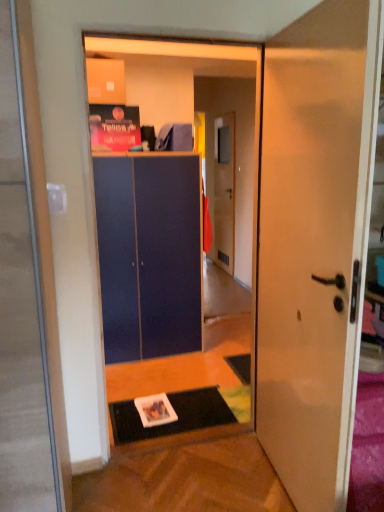
Question: From the image's perspective, is matte blue cabinet at center on top of wooden door at center, which is counted as the 2th door, starting from the front?

Choices:
 (A) no
 (B) yes

Answer: (A)

Question: From a real-world perspective, does matte blue cabinet at center stand above wooden door at center, which appears as the 1th door when viewed from the back?

Choices:
 (A) no
 (B) yes

Answer: (A)

Question: Can you confirm if matte blue cabinet at center is thinner than wooden door at center, which appears as the 1th door when viewed from the back?

Choices:
 (A) yes
 (B) no

Answer: (B)

Question: Considering the relative sizes of matte blue cabinet at center and wooden door at center, which is counted as the 2th door, starting from the front, in the image provided, is matte blue cabinet at center shorter than wooden door at center, which is counted as the 2th door, starting from the front,?

Choices:
 (A) no
 (B) yes

Answer: (B)

Question: Does matte blue cabinet at center lie behind wooden door at center, which is counted as the 2th door, starting from the front?

Choices:
 (A) yes
 (B) no

Answer: (B)

Question: Considering the relative sizes of matte blue cabinet at center and wooden door at center, which appears as the 1th door when viewed from the back, in the image provided, is matte blue cabinet at center bigger than wooden door at center, which appears as the 1th door when viewed from the back,?

Choices:
 (A) no
 (B) yes

Answer: (B)

Question: Considering the relative sizes of black rubber doormat at lower center and matte blue cabinet at center in the image provided, is black rubber doormat at lower center bigger than matte blue cabinet at center?

Choices:
 (A) yes
 (B) no

Answer: (B)

Question: Does black rubber doormat at lower center have a lesser height compared to matte blue cabinet at center?

Choices:
 (A) no
 (B) yes

Answer: (B)

Question: Is black rubber doormat at lower center placed right next to matte blue cabinet at center?

Choices:
 (A) yes
 (B) no

Answer: (B)

Question: Is black rubber doormat at lower center facing towards matte blue cabinet at center?

Choices:
 (A) no
 (B) yes

Answer: (A)

Question: From the image's perspective, is black rubber doormat at lower center below matte blue cabinet at center?

Choices:
 (A) yes
 (B) no

Answer: (A)

Question: Is the depth of black rubber doormat at lower center less than that of matte blue cabinet at center?

Choices:
 (A) no
 (B) yes

Answer: (B)

Question: Is blue matte cabinet at center aimed at white glossy door at center, the first door from the front?

Choices:
 (A) no
 (B) yes

Answer: (B)